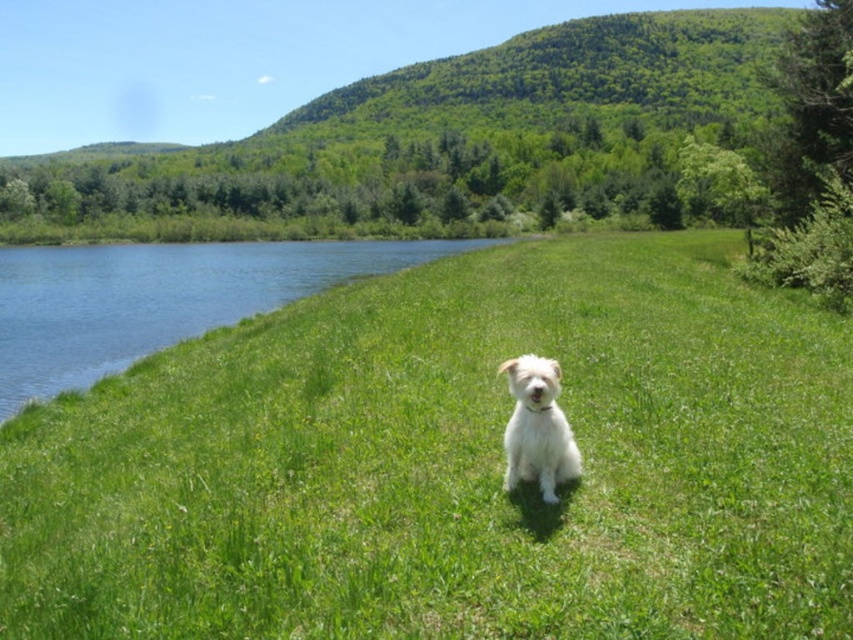
Question: Which object is positioned farthest from the white fluffy dog at center?

Choices:
 (A) blue water at left
 (B) green grassy at center

Answer: (A)

Question: Observing the image, what is the correct spatial positioning of green grassy at center in reference to blue water at left?

Choices:
 (A) left
 (B) right

Answer: (B)

Question: Does blue water at left have a smaller size compared to white fluffy dog at center?

Choices:
 (A) yes
 (B) no

Answer: (B)

Question: Which point is farther to the camera?

Choices:
 (A) (766, 432)
 (B) (0, 298)

Answer: (B)

Question: Which point appears farthest from the camera in this image?

Choices:
 (A) (251, 248)
 (B) (73, 412)
 (C) (509, 458)

Answer: (A)

Question: Is green grassy at center bigger than blue water at left?

Choices:
 (A) yes
 (B) no

Answer: (B)